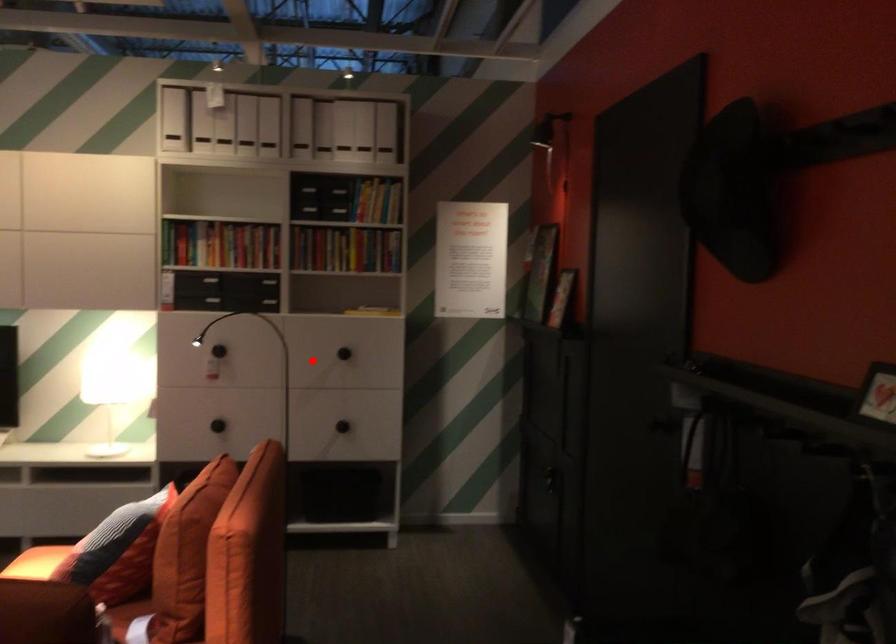
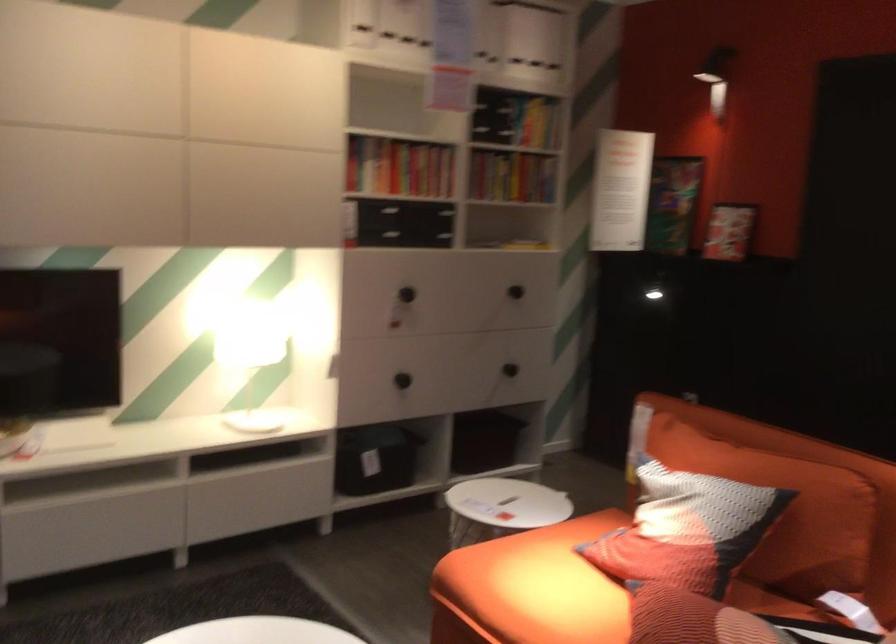
Question: A red point is marked in image1. In image2, is the corresponding 3D point closer to the camera or farther? Reply with the corresponding letter.

Choices:
 (A) The corresponding 3D point is closer.
 (B) The corresponding 3D point is farther.

Answer: (A)